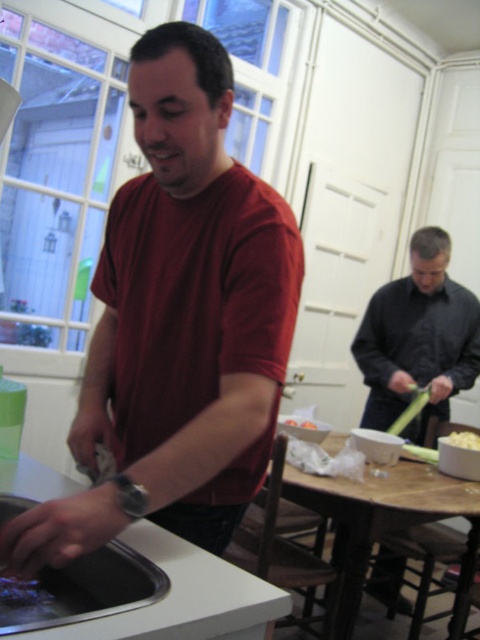
You are a delivery person who needs to leave a package at the kitchen. The package is too heavy to carry far. You can only place it near the closest person to you. Based on the scene, which person should you choose between the matte red shirt at center and the dark gray shirt at right?

The matte red shirt at center is closer to you than the dark gray shirt at right, so you should place the package near the matte red shirt at center.

You are standing in the kitchen and need to hand a dish towel to the person wearing the matte red shirt at center. Based on their position, where should you walk to reach them?

The matte red shirt at center is located at point [178,323], so you should walk towards the center of the kitchen to reach them.